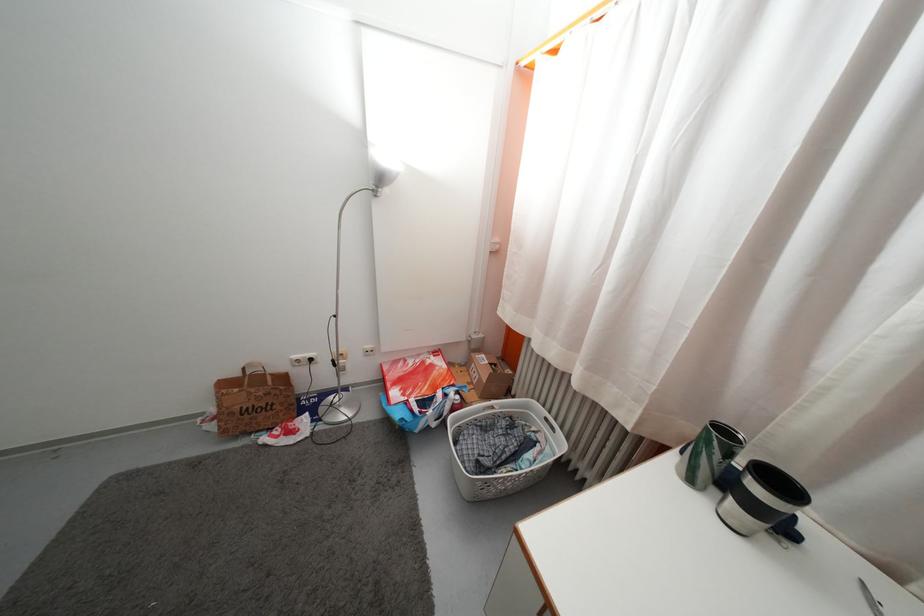
The height and width of the screenshot is (616, 924). Identify the location of black mug handle. (786, 532).